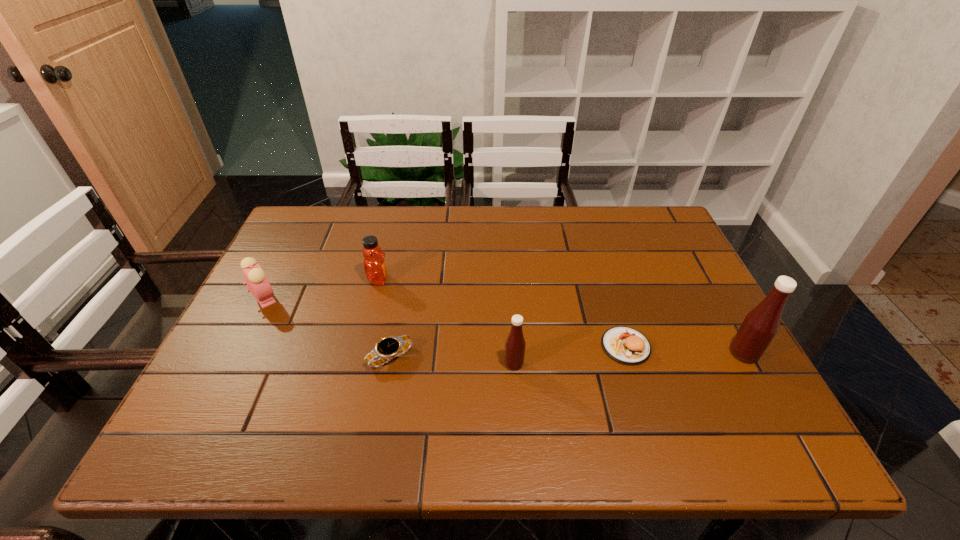
Image resolution: width=960 pixels, height=540 pixels. Identify the location of the shorter Tabasco sauce. (515, 344).

The height and width of the screenshot is (540, 960). What are the coordinates of `the fourth object from left to right` in the screenshot? It's located at (515, 344).

The width and height of the screenshot is (960, 540). I want to click on the tallest object, so click(761, 324).

Identify the location of the right Tabasco sauce. This screenshot has width=960, height=540. (761, 324).

At what (x,y) coordinates should I click in order to perform the action: click on honey. Please return your answer as a coordinate pair (x, y). Looking at the image, I should click on (375, 269).

Where is `the third shortest object`? Image resolution: width=960 pixels, height=540 pixels. the third shortest object is located at coordinates (257, 282).

Locate an element on the screen. This screenshot has width=960, height=540. the leftmost object is located at coordinates (257, 282).

Image resolution: width=960 pixels, height=540 pixels. In order to click on the second shortest object in this screenshot , I will do `click(626, 345)`.

Identify the location of patty. Image resolution: width=960 pixels, height=540 pixels. (626, 345).

Locate an element on the screen. The image size is (960, 540). the shortest object is located at coordinates (390, 347).